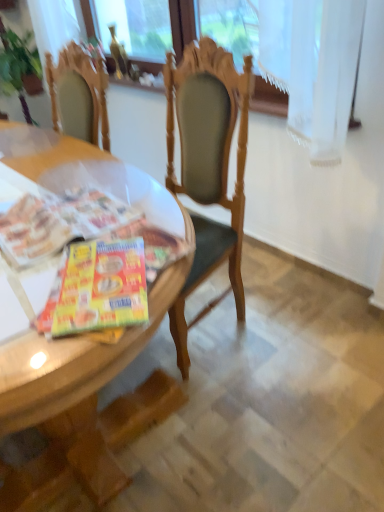
Question: Considering the relative positions of gold glass bottle at upper center and wooden desk at center in the image provided, is gold glass bottle at upper center to the right of wooden desk at center from the viewer's perspective?

Choices:
 (A) no
 (B) yes

Answer: (B)

Question: Does gold glass bottle at upper center have a smaller size compared to wooden desk at center?

Choices:
 (A) yes
 (B) no

Answer: (A)

Question: Does gold glass bottle at upper center have a larger size compared to wooden desk at center?

Choices:
 (A) yes
 (B) no

Answer: (B)

Question: Can you confirm if gold glass bottle at upper center is taller than wooden desk at center?

Choices:
 (A) no
 (B) yes

Answer: (A)

Question: Does gold glass bottle at upper center have a lesser width compared to wooden desk at center?

Choices:
 (A) no
 (B) yes

Answer: (B)

Question: Visually, is shiny plastic magazine at table left positioned to the left or to the right of wooden desk at center?

Choices:
 (A) left
 (B) right

Answer: (B)

Question: Considering the positions of shiny plastic magazine at table left and wooden desk at center in the image, is shiny plastic magazine at table left wider or thinner than wooden desk at center?

Choices:
 (A) wide
 (B) thin

Answer: (B)

Question: Is shiny plastic magazine at table left taller or shorter than wooden desk at center?

Choices:
 (A) tall
 (B) short

Answer: (B)

Question: From the image's perspective, is shiny plastic magazine at table left located above or below wooden desk at center?

Choices:
 (A) below
 (B) above

Answer: (B)

Question: Does point (115, 46) appear closer or farther from the camera than point (74, 470)?

Choices:
 (A) farther
 (B) closer

Answer: (A)

Question: From the image's perspective, is gold glass bottle at upper center located above or below wooden desk at center?

Choices:
 (A) below
 (B) above

Answer: (B)

Question: Is gold glass bottle at upper center in front of or behind wooden desk at center in the image?

Choices:
 (A) behind
 (B) front

Answer: (A)

Question: From a real-world perspective, is gold glass bottle at upper center positioned above or below wooden desk at center?

Choices:
 (A) above
 (B) below

Answer: (A)

Question: Is shiny plastic magazine at table left inside or outside of gold glass bottle at upper center?

Choices:
 (A) inside
 (B) outside

Answer: (B)

Question: In terms of width, does shiny plastic magazine at table left look wider or thinner when compared to gold glass bottle at upper center?

Choices:
 (A) thin
 (B) wide

Answer: (B)